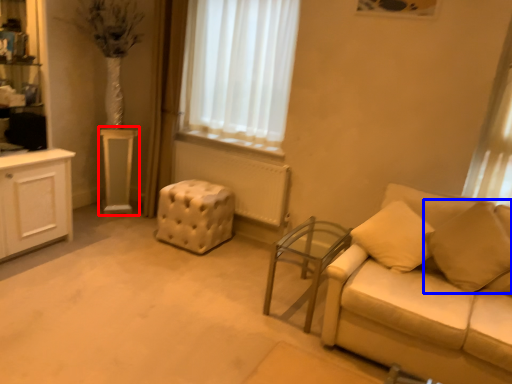
Question: Which of the following is the closest to the observer, table (highlighted by a red box) or pillow (highlighted by a blue box)?

Choices:
 (A) table
 (B) pillow

Answer: (B)